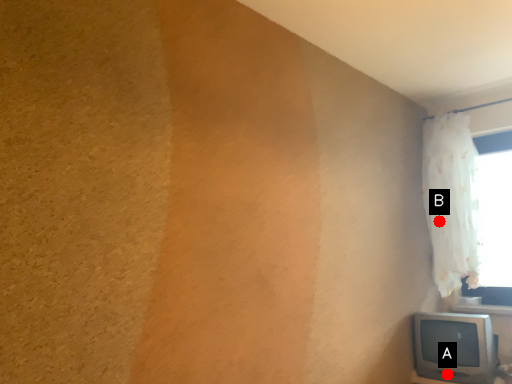
Question: Two points are circled on the image, labeled by A and B beside each circle. Among these points, which one is farthest from the camera?

Choices:
 (A) A is further
 (B) B is further

Answer: (B)